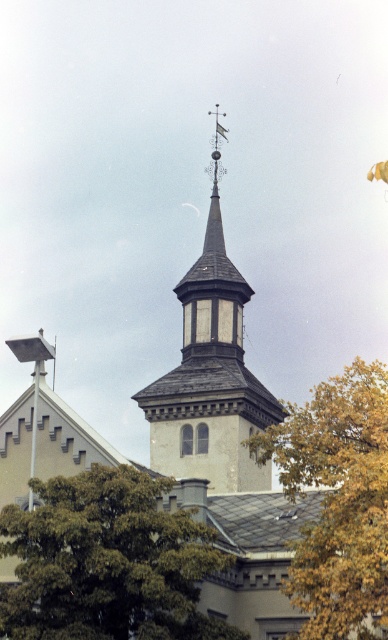
You are standing in front of the building with the tower. You notice two trees, the green leafy tree at lower left and the yellow leafy tree at upper right. Which tree is shorter?

The green leafy tree at lower left is shorter than the yellow leafy tree at upper right.

You are a drone operator planning to fly a drone between the yellow leafy tree at upper right and the smooth gray steeple at center. The drone has a maximum flight distance of 20 meters. Can the drone safely fly between them without exceeding its range?

The yellow leafy tree at upper right and smooth gray steeple at center are 20.57 meters apart from each other. Since the distance exceeds the drone maximum flight range of 20 meters, the drone cannot safely fly between them without exceeding its range.

You are an architect analyzing the building. You notice the green leafy tree at lower left and the yellow leafy tree at upper right. Which tree has a smaller width?

The green leafy tree at lower left is thinner than the yellow leafy tree at upper right, so the green leafy tree at lower left has a smaller width.